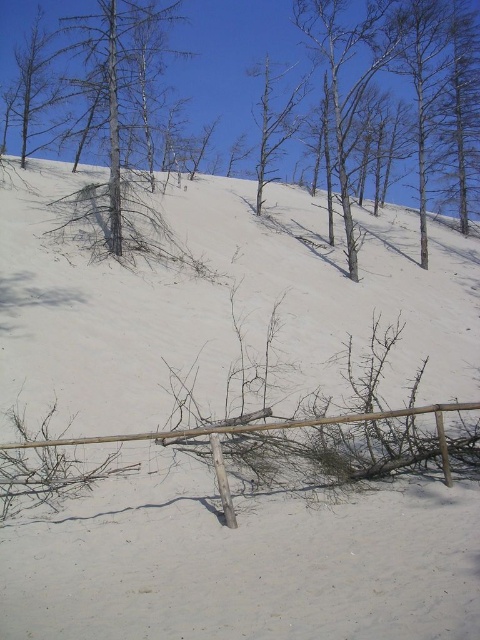
You are navigating a drone over the sandy dune landscape and need to drop a marker at the exact location of the dead wood at center. According to the coordinates provided, where should you aim the drone to place the marker?

The dead wood at center is located at point (233,60), so you should aim the drone to place the marker at those coordinates.